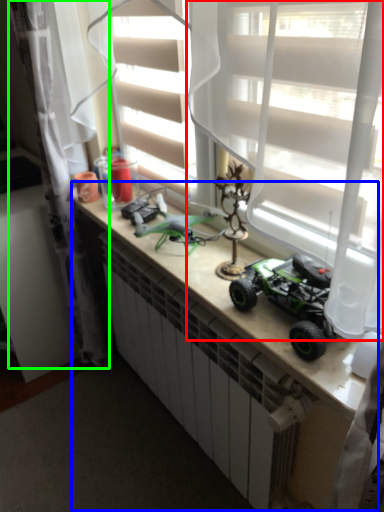
Question: Estimate the real-world distances between objects in this image. Which object is closer to curtain (highlighted by a red box), counter (highlighted by a blue box) or curtain (highlighted by a green box)?

Choices:
 (A) counter
 (B) curtain

Answer: (A)